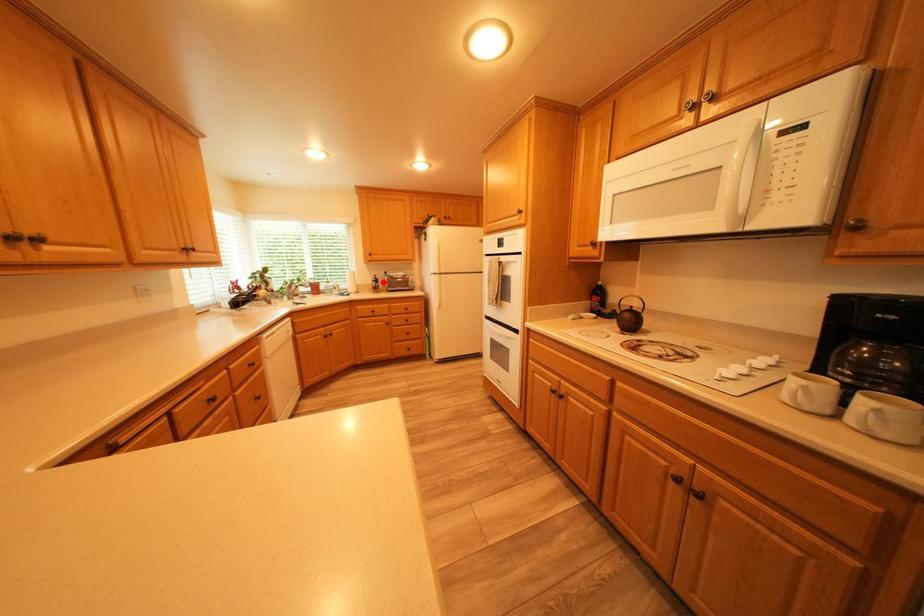
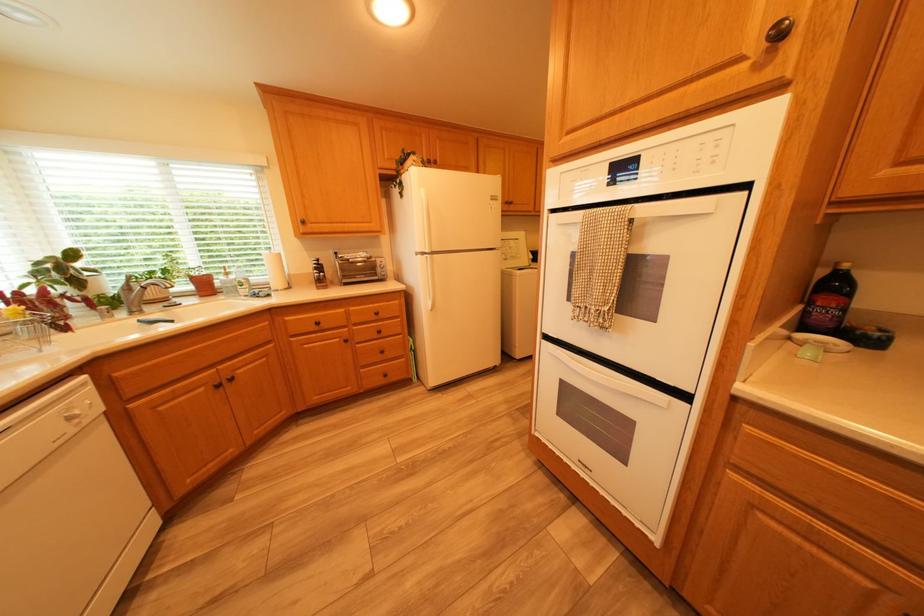
Locate, in the second image, the point that corresponds to the highlighted location in the first image.

(322, 269)